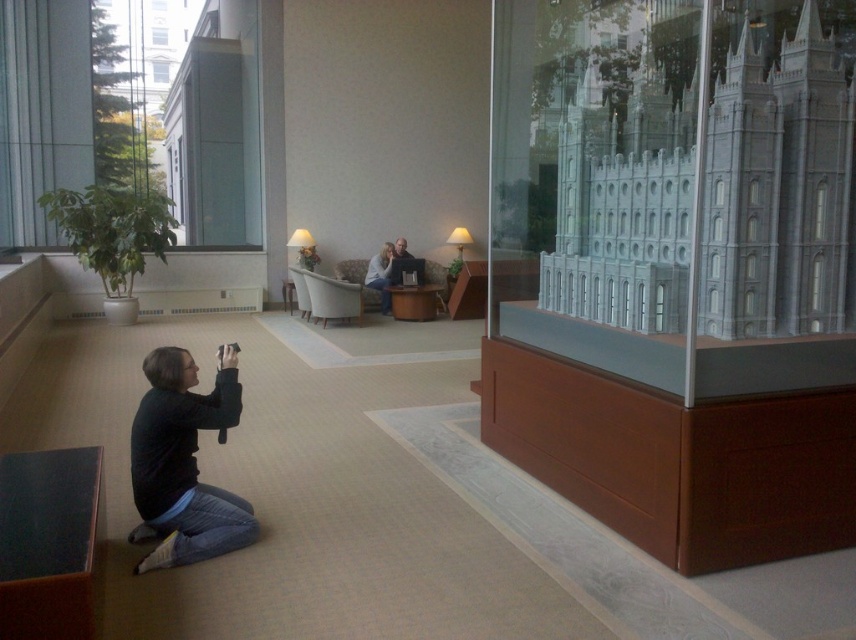
Question: Among these points, which one is nearest to the camera?

Choices:
 (A) (370, 262)
 (B) (150, 390)

Answer: (B)

Question: Observing the image, what is the correct spatial positioning of black fabric squat at lower left in reference to light brown leather couch at center?

Choices:
 (A) left
 (B) right

Answer: (A)

Question: Does black fabric squat at lower left have a larger size compared to light brown leather couch at center?

Choices:
 (A) yes
 (B) no

Answer: (B)

Question: Which point appears closest to the camera in this image?

Choices:
 (A) (379, 248)
 (B) (150, 376)

Answer: (B)

Question: Among these points, which one is farthest from the camera?

Choices:
 (A) (214, 528)
 (B) (389, 294)

Answer: (B)

Question: Does black fabric squat at lower left appear on the left side of light brown leather couch at center?

Choices:
 (A) no
 (B) yes

Answer: (B)